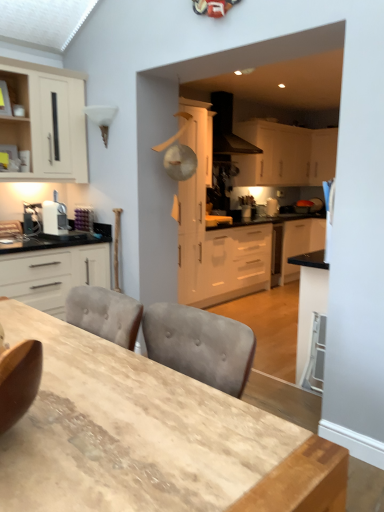
What do you see at coordinates (194, 203) in the screenshot?
I see `white matte cabinet at center, the third cabinetry viewed from the front` at bounding box center [194, 203].

This screenshot has width=384, height=512. What do you see at coordinates (322, 155) in the screenshot?
I see `white glossy cabinet at upper right, which is the 5th cabinetry in left-to-right order` at bounding box center [322, 155].

You are a GUI agent. You are given a task and a screenshot of the screen. Output one action in this format:
    pyautogui.click(x=<x>, y=<y>)
    Task: Click on the white matte cabinet at left, which is the 4th cabinetry from right to left
    This screenshot has width=384, height=512.
    Given the screenshot: What is the action you would take?
    pyautogui.click(x=53, y=275)

Considering the positions of points (181, 296) and (56, 149), is point (181, 296) farther from camera compared to point (56, 149)?

Yes, it is behind point (56, 149).

From the image's perspective, is white glossy countertop at center beneath matte white cabinet at upper left, which is the 1th cabinetry from left to right?

Yes, from the image's perspective, white glossy countertop at center is beneath matte white cabinet at upper left, which is the 1th cabinetry from left to right.

Is white glossy countertop at center positioned with its back to matte white cabinet at upper left, which is the 1th cabinetry from left to right?

No, white glossy countertop at center is not facing the opposite direction of matte white cabinet at upper left, which is the 1th cabinetry from left to right.

Does white glossy countertop at center have a greater width compared to matte white cabinet at upper left, positioned as the fourth cabinetry in back-to-front order?

Yes.

Between matte white cabinet at upper left, which is the 1th cabinetry from left to right, and wooden table at center, which one appears on the left side from the viewer's perspective?

matte white cabinet at upper left, which is the 1th cabinetry from left to right.

Does matte white cabinet at upper left, which is counted as the fifth cabinetry, starting from the right, come in front of wooden table at center?

No, it is behind wooden table at center.

Consider the image. Does matte white cabinet at upper left, which is counted as the fifth cabinetry, starting from the right, have a larger size compared to wooden table at center?

No.

Which object is wider, matte white cabinet at upper left, which is the 1th cabinetry from left to right, or wooden table at center?

Wider between the two is wooden table at center.

Is white matte cabinet at upper center, which ranks as the fourth cabinetry in left-to-right order, situated inside white glossy countertop at center or outside?

white matte cabinet at upper center, which ranks as the fourth cabinetry in left-to-right order, is not inside white glossy countertop at center, it's outside.

Which point is more forward, (250, 159) or (281, 244)?

Positioned in front is point (281, 244).

From the image's perspective, is white matte cabinet at upper center, marked as the 2th cabinetry in a right-to-left arrangement, on top of white glossy countertop at center?

Yes.

Who is bigger, white matte cabinet at upper center, placed as the 2th cabinetry when sorted from back to front, or white glossy countertop at center?

white glossy countertop at center.

Is matte white cabinet at upper left, positioned as the fourth cabinetry in back-to-front order, surrounding white matte cabinet at upper center, placed as the 2th cabinetry when sorted from back to front?

No.

Which object is wider, matte white cabinet at upper left, which is the 1th cabinetry from left to right, or white matte cabinet at upper center, which ranks as the fourth cabinetry in left-to-right order?

Answer: matte white cabinet at upper left, which is the 1th cabinetry from left to right, is wider.

Is matte white cabinet at upper left, which is the 1th cabinetry from left to right, facing away from white matte cabinet at upper center, marked as the 2th cabinetry in a right-to-left arrangement?

No, matte white cabinet at upper left, which is the 1th cabinetry from left to right, is not facing the opposite direction of white matte cabinet at upper center, marked as the 2th cabinetry in a right-to-left arrangement.

Where is `the 1st cabinetry below the white matte cabinet at upper center, positioned as the fourth cabinetry in front-to-back order (from the image's perspective)`? The height and width of the screenshot is (512, 384). the 1st cabinetry below the white matte cabinet at upper center, positioned as the fourth cabinetry in front-to-back order (from the image's perspective) is located at coordinates (47, 121).

Is wooden table at center positioned beyond the bounds of matte white cabinet at upper left, which is counted as the fifth cabinetry, starting from the right?

Yes.

Where is `table below the matte white cabinet at upper left, positioned as the fourth cabinetry in back-to-front order (from a real-world perspective)`? This screenshot has height=512, width=384. table below the matte white cabinet at upper left, positioned as the fourth cabinetry in back-to-front order (from a real-world perspective) is located at coordinates (150, 437).

Between wooden table at center and matte white cabinet at upper left, positioned as the fourth cabinetry in back-to-front order, which one has larger width?

With larger width is wooden table at center.

In terms of height, does wooden table at center look taller or shorter compared to matte white cabinet at upper left, which is the 1th cabinetry from left to right?

In the image, wooden table at center appears to be shorter than matte white cabinet at upper left, which is the 1th cabinetry from left to right.

From the image's perspective, is white matte cabinet at upper center, placed as the 2th cabinetry when sorted from back to front, on top of matte white cabinet at upper left, which is the 1th cabinetry from left to right?

Yes.

Looking at this image, can you confirm if white matte cabinet at upper center, placed as the 2th cabinetry when sorted from back to front, is positioned to the left of matte white cabinet at upper left, which is the 1th cabinetry from left to right?

No.

Is white matte cabinet at upper center, positioned as the fourth cabinetry in front-to-back order, facing towards matte white cabinet at upper left, positioned as the fourth cabinetry in back-to-front order?

No.

Is white matte cabinet at upper center, positioned as the fourth cabinetry in front-to-back order, shorter than matte white cabinet at upper left, which is the 1th cabinetry from left to right?

Yes, white matte cabinet at upper center, positioned as the fourth cabinetry in front-to-back order, is shorter than matte white cabinet at upper left, which is the 1th cabinetry from left to right.

Which of these two, black matte range hood at upper center or matte white cabinet at upper left, which is counted as the fifth cabinetry, starting from the right, is bigger?

With larger size is matte white cabinet at upper left, which is counted as the fifth cabinetry, starting from the right.

Which object is thinner, black matte range hood at upper center or matte white cabinet at upper left, positioned as the fourth cabinetry in back-to-front order?

With smaller width is matte white cabinet at upper left, positioned as the fourth cabinetry in back-to-front order.

Find the location of a particular element. The image size is (384, 512). counter on the right of matte white cabinet at upper left, which is counted as the fifth cabinetry, starting from the right is located at coordinates (225, 264).

Locate an element on the screen. cabinetry that is the 2nd one when counting backward from the wooden table at center is located at coordinates 47,121.

Estimate the real-world distances between objects in this image. Which object is further from white matte cabinet at left, the 2th cabinetry from the left, white glossy cabinet at upper right, which is the 5th cabinetry in left-to-right order, or white glossy countertop at center?

white glossy cabinet at upper right, which is the 5th cabinetry in left-to-right order, is further to white matte cabinet at left, the 2th cabinetry from the left.

Based on the photo, looking at the image, which one is located further to matte white cabinet at upper left, which is the 1th cabinetry from left to right, wooden table at center or white glossy countertop at center?

Among the two, wooden table at center is located further to matte white cabinet at upper left, which is the 1th cabinetry from left to right.

Estimate the real-world distances between objects in this image. Which object is further from wooden table at center, white glossy cabinet at upper right, arranged as the 5th cabinetry when viewed from the front, or white matte cabinet at left, which is the 4th cabinetry from right to left?

white glossy cabinet at upper right, arranged as the 5th cabinetry when viewed from the front, lies further to wooden table at center than the other object.

When comparing their distances from white glossy countertop at center, does white matte cabinet at center, arranged as the third cabinetry when viewed from the right, or white matte cabinet at upper center, positioned as the fourth cabinetry in front-to-back order, seem further?

white matte cabinet at upper center, positioned as the fourth cabinetry in front-to-back order, lies further to white glossy countertop at center than the other object.

Considering their positions, is white matte cabinet at left, the 2th cabinetry from the left, positioned further to white glossy countertop at center than white matte cabinet at center, which is counted as the third cabinetry, starting from the left?

The object further to white glossy countertop at center is white matte cabinet at left, the 2th cabinetry from the left.

When comparing their distances from white matte cabinet at left, the 2th cabinetry from the left, does white glossy cabinet at upper right, placed as the first cabinetry when sorted from right to left, or matte white cabinet at upper left, the second cabinetry viewed from the front, seem closer?

Based on the image, matte white cabinet at upper left, the second cabinetry viewed from the front, appears to be nearer to white matte cabinet at left, the 2th cabinetry from the left.

Which object lies nearer to the anchor point matte white cabinet at upper left, the second cabinetry viewed from the front, white glossy cabinet at upper right, which is the 5th cabinetry in left-to-right order, or white matte cabinet at upper center, positioned as the fourth cabinetry in front-to-back order?

white matte cabinet at upper center, positioned as the fourth cabinetry in front-to-back order, lies closer to matte white cabinet at upper left, the second cabinetry viewed from the front, than the other object.

Which object lies nearer to the anchor point black matte range hood at upper center, white matte cabinet at center, the third cabinetry viewed from the front, or white glossy cabinet at upper right, which is the 5th cabinetry in left-to-right order?

white matte cabinet at center, the third cabinetry viewed from the front, is positioned closer to the anchor black matte range hood at upper center.

Identify the location of counter between white matte cabinet at center, the third cabinetry viewed from the front, and white matte cabinet at upper center, marked as the 2th cabinetry in a right-to-left arrangement, in the front-back direction. (225, 264).

Where is `cabinetry positioned between matte white cabinet at upper left, which is counted as the fifth cabinetry, starting from the right, and white matte cabinet at upper center, positioned as the fourth cabinetry in front-to-back order, from near to far`? The height and width of the screenshot is (512, 384). cabinetry positioned between matte white cabinet at upper left, which is counted as the fifth cabinetry, starting from the right, and white matte cabinet at upper center, positioned as the fourth cabinetry in front-to-back order, from near to far is located at coordinates (194, 203).

What are the coordinates of `cabinetry positioned between white matte cabinet at center, the third cabinetry viewed from the front, and white glossy cabinet at upper right, the 1th cabinetry when ordered from back to front, from near to far` in the screenshot? It's located at (286, 155).

Locate an element on the screen. The height and width of the screenshot is (512, 384). kitchen appliance positioned between wooden table at center and white matte cabinet at upper center, positioned as the fourth cabinetry in front-to-back order, from near to far is located at coordinates (227, 128).